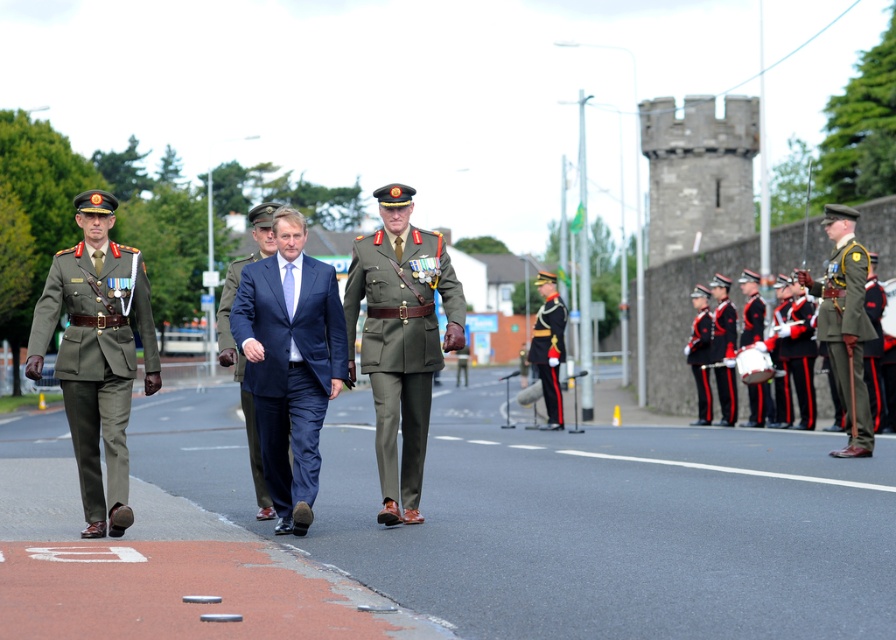
Question: Which object appears farthest from the camera in this image?

Choices:
 (A) dark blue suit at center
 (B) green matte uniform at right

Answer: (B)

Question: Does green matte uniform at right have a greater width compared to shiny gold helmet at center?

Choices:
 (A) no
 (B) yes

Answer: (B)

Question: Is green matte uniform at right wider than dark blue suit at center?

Choices:
 (A) yes
 (B) no

Answer: (B)

Question: Estimate the real-world distances between objects in this image. Which object is farther from the shiny gold helmet at center?

Choices:
 (A) dark blue suit at center
 (B) green matte uniform at right
 (C) navy blue suit at center
 (D) matte olive-green uniform at center

Answer: (C)

Question: Does navy blue suit at center have a lesser width compared to shiny gold helmet at center?

Choices:
 (A) no
 (B) yes

Answer: (A)

Question: Which point is farther to the camera?

Choices:
 (A) (851, 236)
 (B) (552, 380)
 (C) (265, 221)

Answer: (B)